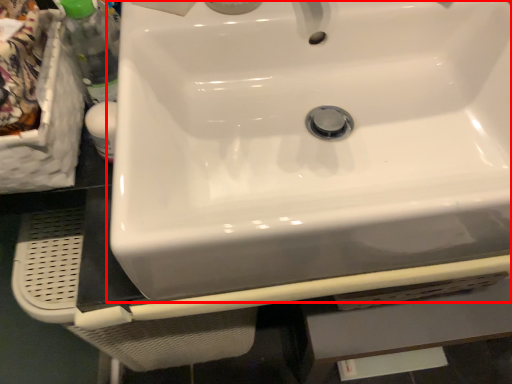
Question: Observing the image, what is the correct spatial positioning of sink (annotated by the red box) in reference to bottle?

Choices:
 (A) left
 (B) right

Answer: (B)